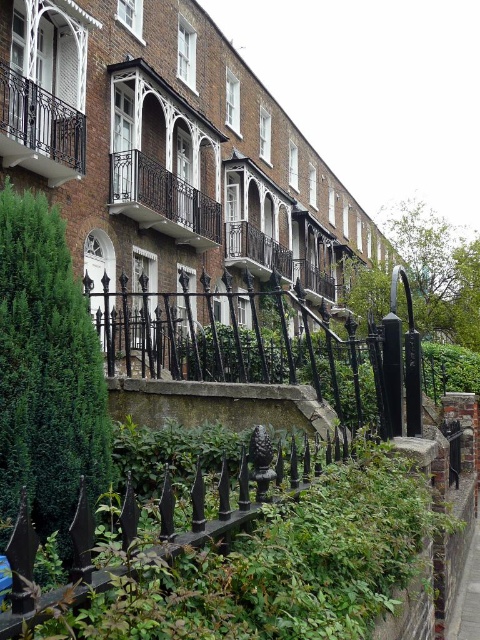
Can you confirm if black wrought iron balcony at upper left is wider than concrete pavement at lower right?

Indeed, black wrought iron balcony at upper left has a greater width compared to concrete pavement at lower right.

Image resolution: width=480 pixels, height=640 pixels. In order to click on black wrought iron balcony at upper left in this screenshot , I will do `click(39, 129)`.

Which is more to the left, green leafy hedge at lower left or black wrought iron balcony at upper left?

black wrought iron balcony at upper left is more to the left.

Is point (6, 205) closer to viewer compared to point (60, 140)?

Yes.

Is point (54, 445) farther from camera compared to point (6, 104)?

No, it is in front of (6, 104).

In order to click on green leafy hedge at lower left in this screenshot , I will do `click(47, 372)`.

Is point (36, 392) positioned before point (477, 577)?

Yes, it is in front of point (477, 577).

Is green leafy hedge at lower left to the left of concrete pavement at lower right from the viewer's perspective?

Correct, you'll find green leafy hedge at lower left to the left of concrete pavement at lower right.

In order to click on green leafy hedge at lower left in this screenshot , I will do `click(47, 372)`.

Image resolution: width=480 pixels, height=640 pixels. What are the coordinates of `green leafy hedge at lower left` in the screenshot? It's located at pyautogui.click(x=47, y=372).